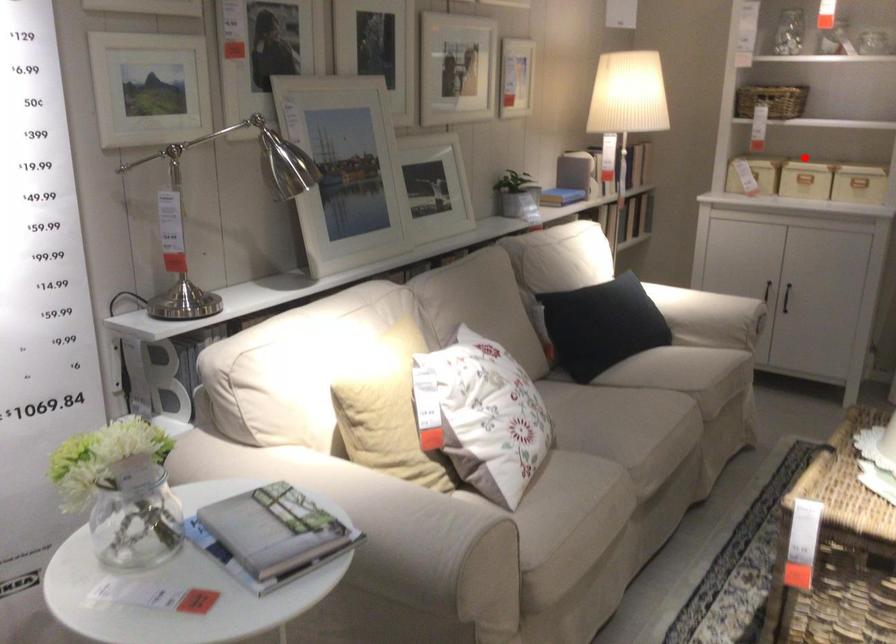
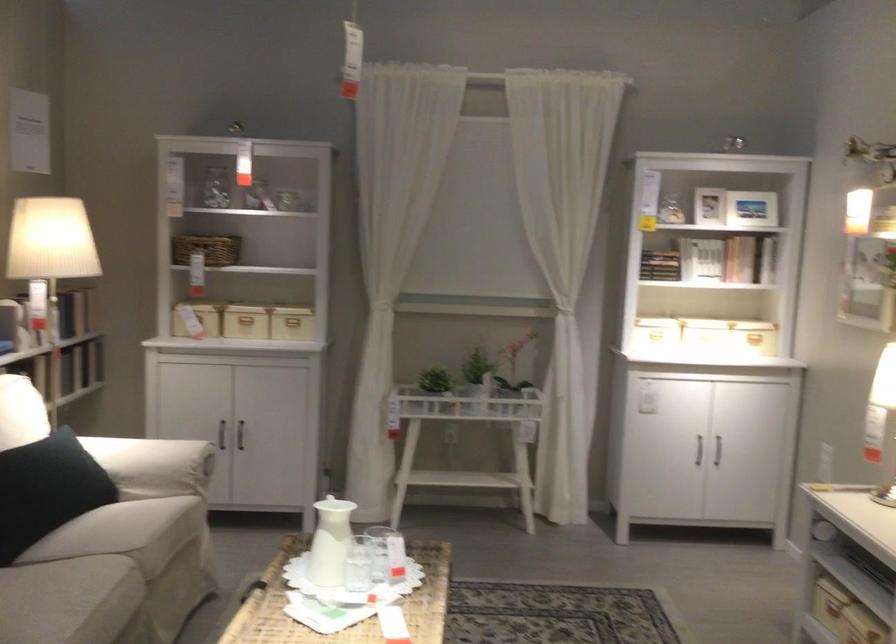
Find the pixel in the second image that matches the highlighted location in the first image.

(245, 319)